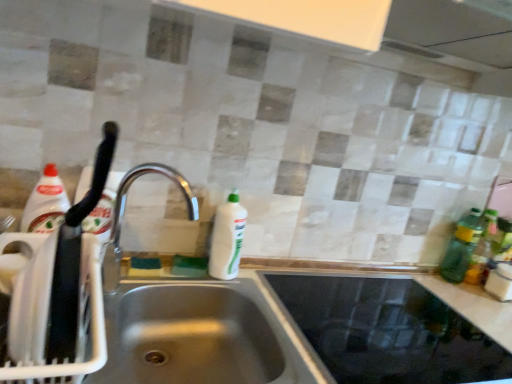
Question: Is the depth of green translucent bottle at right, arranged as the 2th bottle when viewed from the right, less than that of white glossy bottle at center?

Choices:
 (A) yes
 (B) no

Answer: (B)

Question: Is white glossy bottle at center surrounded by green translucent bottle at right, positioned as the 1th bottle in left-to-right order?

Choices:
 (A) yes
 (B) no

Answer: (B)

Question: Is green translucent bottle at right, positioned as the 1th bottle in left-to-right order, shorter than white glossy bottle at center?

Choices:
 (A) yes
 (B) no

Answer: (B)

Question: From a real-world perspective, is green translucent bottle at right, arranged as the 2th bottle when viewed from the right, on top of white glossy bottle at center?

Choices:
 (A) no
 (B) yes

Answer: (B)

Question: Considering the relative sizes of green translucent bottle at right, arranged as the 2th bottle when viewed from the right, and white glossy bottle at center in the image provided, is green translucent bottle at right, arranged as the 2th bottle when viewed from the right, smaller than white glossy bottle at center?

Choices:
 (A) yes
 (B) no

Answer: (A)

Question: Does green translucent bottle at right, arranged as the 2th bottle when viewed from the right, have a lesser width compared to white glossy bottle at center?

Choices:
 (A) yes
 (B) no

Answer: (A)

Question: Can you confirm if green plastic bottle at right, arranged as the 2th bottle when viewed from the left, is taller than satin steel sink at center?

Choices:
 (A) yes
 (B) no

Answer: (B)

Question: Does green plastic bottle at right, arranged as the 1th bottle when viewed from the right, have a lesser width compared to satin steel sink at center?

Choices:
 (A) no
 (B) yes

Answer: (B)

Question: Considering the relative positions of green plastic bottle at right, arranged as the 2th bottle when viewed from the left, and satin steel sink at center in the image provided, is green plastic bottle at right, arranged as the 2th bottle when viewed from the left, to the left of satin steel sink at center from the viewer's perspective?

Choices:
 (A) yes
 (B) no

Answer: (B)

Question: From a real-world perspective, is green plastic bottle at right, arranged as the 1th bottle when viewed from the right, physically below satin steel sink at center?

Choices:
 (A) yes
 (B) no

Answer: (B)

Question: Is green plastic bottle at right, arranged as the 2th bottle when viewed from the left, directly adjacent to satin steel sink at center?

Choices:
 (A) no
 (B) yes

Answer: (A)

Question: Is green plastic bottle at right, arranged as the 2th bottle when viewed from the left, further to the viewer compared to satin steel sink at center?

Choices:
 (A) yes
 (B) no

Answer: (A)

Question: Does silver metallic faucet at center contain green plastic bottle at right, arranged as the 2th bottle when viewed from the left?

Choices:
 (A) no
 (B) yes

Answer: (A)